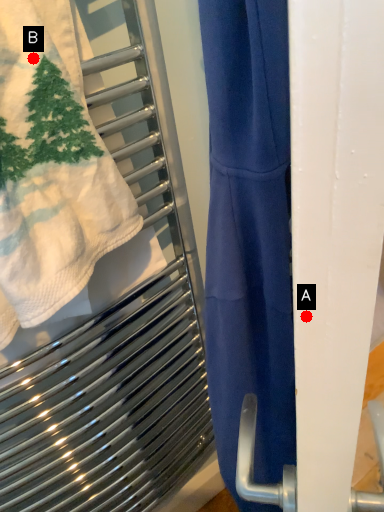
Question: Two points are circled on the image, labeled by A and B beside each circle. Which point is farther from the camera taking this photo?

Choices:
 (A) A is further
 (B) B is further

Answer: (B)